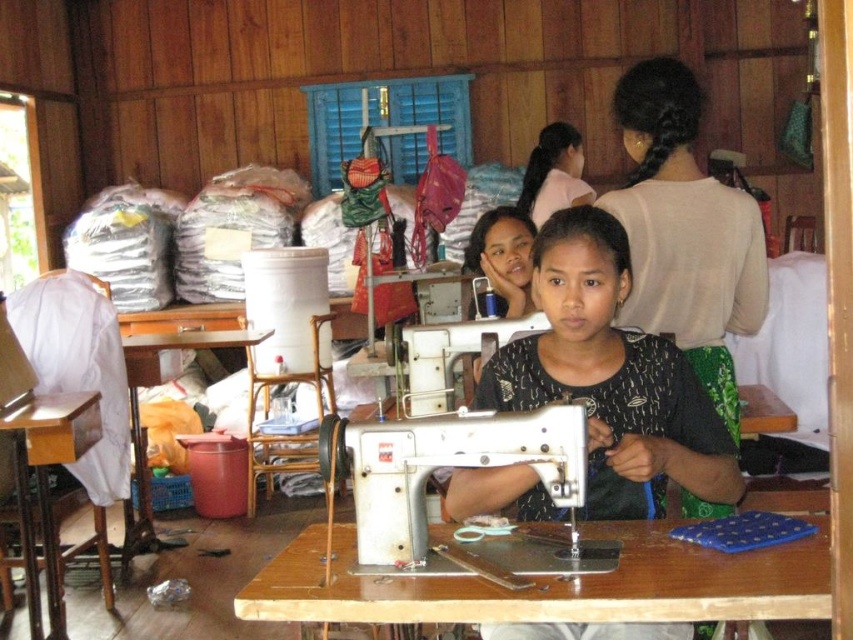
Is point (523, 401) behind point (532, 198)?

No, (523, 401) is in front of (532, 198).

Between point (709, 442) and point (526, 164), which one is positioned in front?

Point (709, 442) is in front.

At what (x,y) coordinates should I click in order to perform the action: click on black matte shirt at center. Please return your answer as a coordinate pair (x, y). This screenshot has height=640, width=853. Looking at the image, I should click on (611, 378).

Is point (611, 344) farther from camera compared to point (509, 410)?

That is True.

Where is `black matte shirt at center`? black matte shirt at center is located at coordinates (611, 378).

Between point (613, 499) and point (463, 412), which one is positioned in front?

Point (463, 412) is in front.

In order to click on black matte shirt at center in this screenshot , I will do `click(611, 378)`.

What do you see at coordinates (685, 230) in the screenshot?
I see `light beige sweater at upper right` at bounding box center [685, 230].

Who is taller, light beige sweater at upper right or white metallic sewing machine at center?

With more height is light beige sweater at upper right.

Identify the location of light beige sweater at upper right. (685, 230).